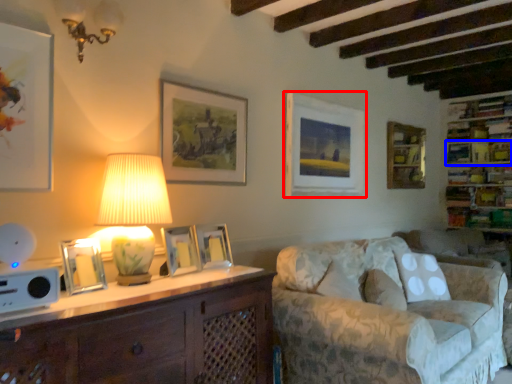
Question: Which object appears closest to the camera in this image, picture frame (highlighted by a red box) or shelf (highlighted by a blue box)?

Choices:
 (A) picture frame
 (B) shelf

Answer: (A)